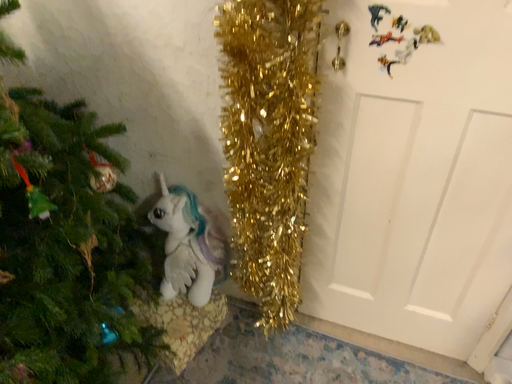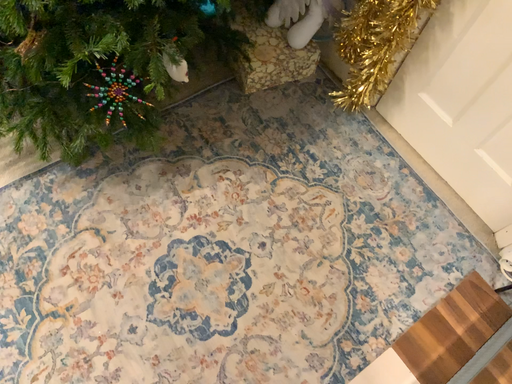
Question: Which way did the camera rotate in the video?

Choices:
 (A) rotated left
 (B) rotated right

Answer: (A)